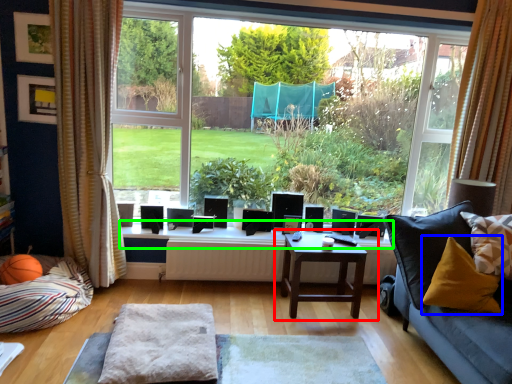
Question: Based on their relative distances, which object is nearer to table (highlighted by a red box)? Choose from pillow (highlighted by a blue box) and window sill (highlighted by a green box).

Choices:
 (A) pillow
 (B) window sill

Answer: (B)